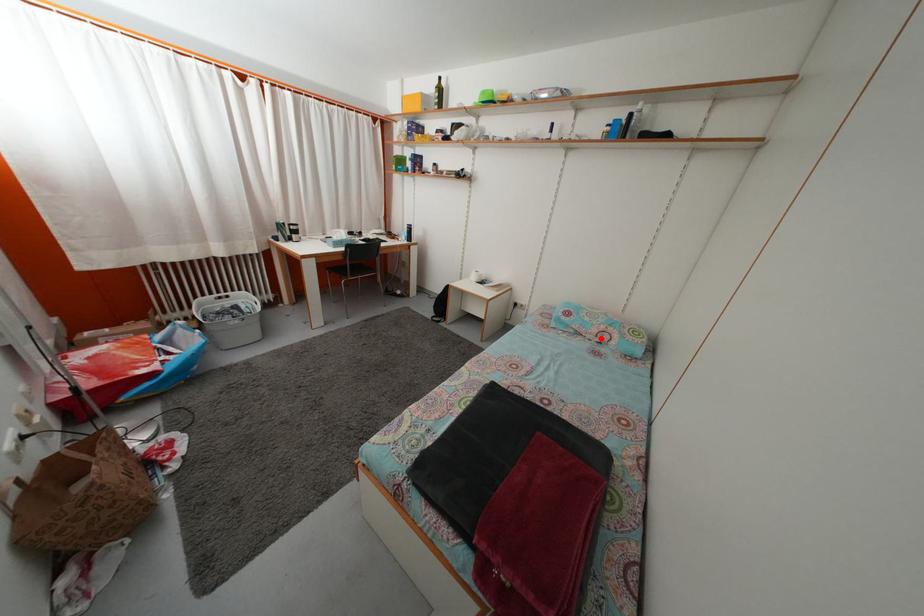
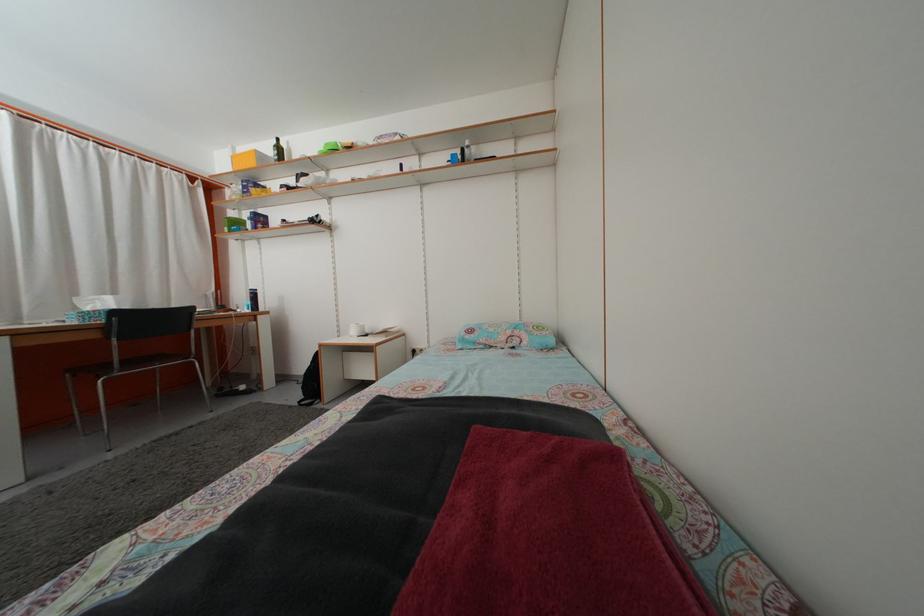
Where in the second image is the point corresponding to the highlighted location from the first image?

(508, 346)